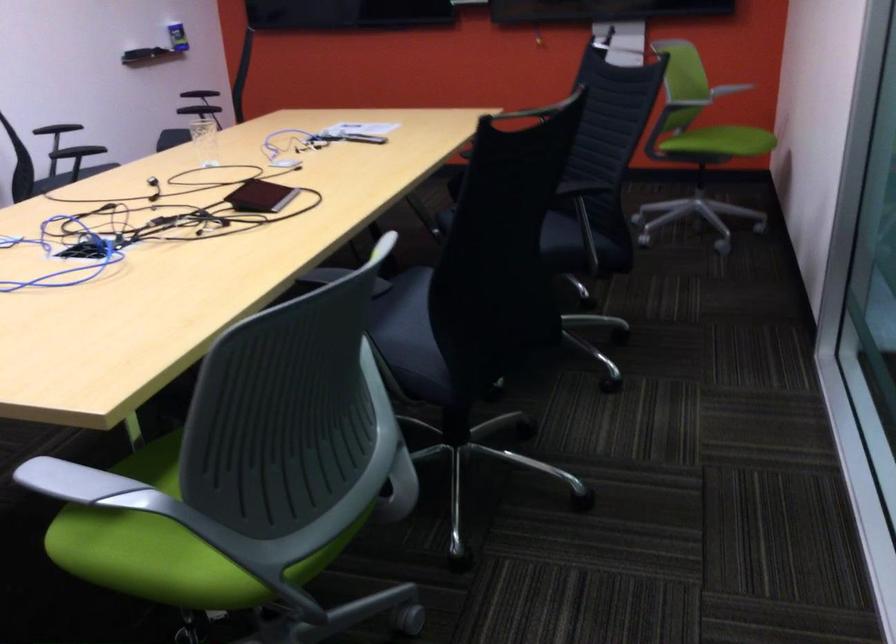
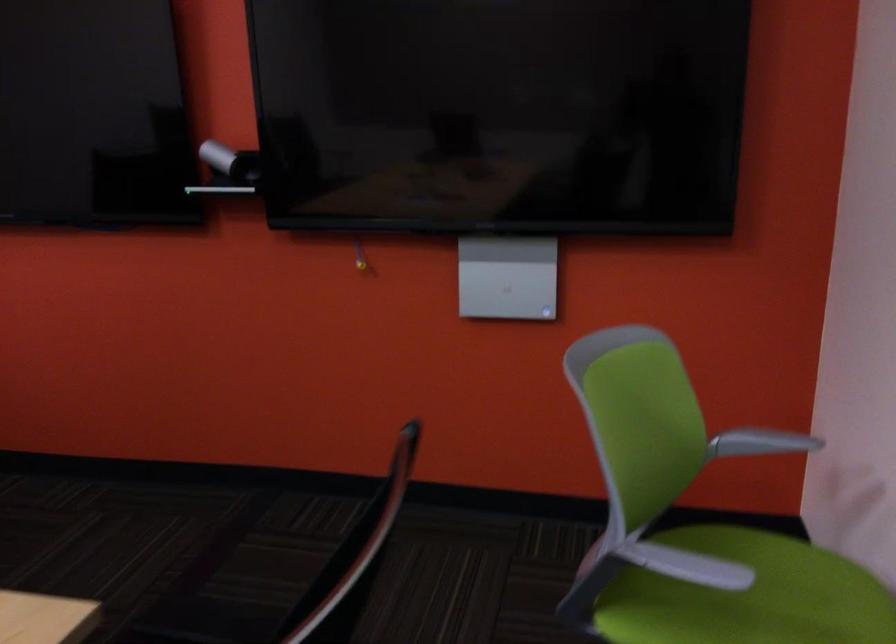
In the second image, find the point that corresponds to [727,131] in the first image.

(747, 596)